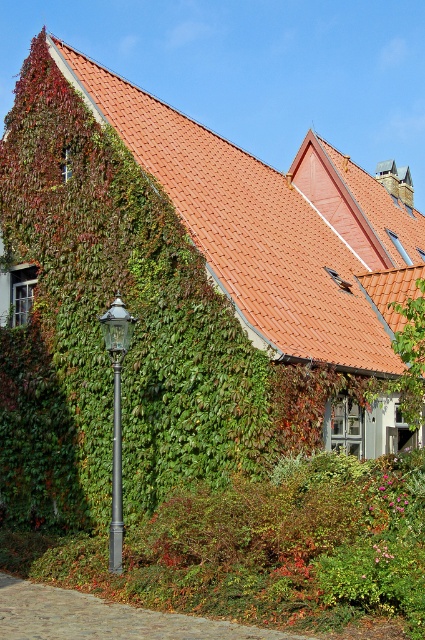
Question: Estimate the real-world distances between objects in this image. Which object is closer to the dark gray metallic pole at lower left?

Choices:
 (A) polished metal lamp post at left
 (B) orange tile roof at upper center

Answer: (A)

Question: In this image, where is polished metal lamp post at left located relative to dark gray metallic pole at lower left?

Choices:
 (A) left
 (B) right

Answer: (B)

Question: Can you confirm if orange tile roof at upper center is positioned to the right of dark gray metallic pole at lower left?

Choices:
 (A) no
 (B) yes

Answer: (B)

Question: Which object is farther from the camera taking this photo?

Choices:
 (A) dark gray metallic pole at lower left
 (B) polished metal lamp post at left
 (C) orange tile roof at upper center

Answer: (C)

Question: Is polished metal lamp post at left smaller than dark gray metallic pole at lower left?

Choices:
 (A) yes
 (B) no

Answer: (B)

Question: Which point appears farthest from the camera in this image?

Choices:
 (A) (181, 124)
 (B) (118, 468)
 (C) (115, 444)

Answer: (A)